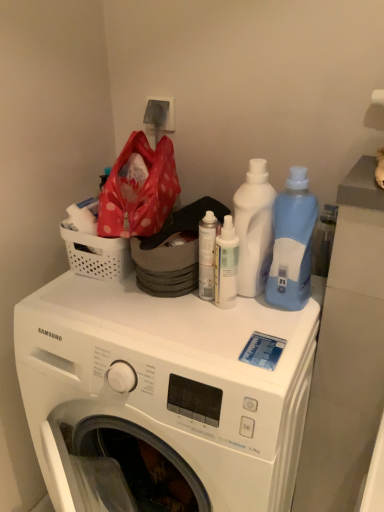
This screenshot has height=512, width=384. I want to click on free location in front of white perforated basket at upper left, so (x=96, y=307).